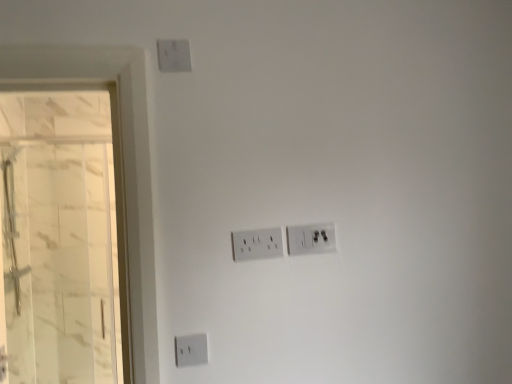
Question: Based on their sizes in the image, would you say white plastic power plugs and sockets at center, the 1th power plugs and sockets viewed from the left, is bigger or smaller than white marble glass door at left?

Choices:
 (A) small
 (B) big

Answer: (A)

Question: Is white plastic power plugs and sockets at center, the 1th power plugs and sockets viewed from the left, in front of or behind white marble glass door at left in the image?

Choices:
 (A) behind
 (B) front

Answer: (B)

Question: Which object is positioned closest to the white marble glass door at left?

Choices:
 (A) white plastic power plugs and sockets at center, the 1th power plugs and sockets viewed from the left
 (B) white plastic power plugs and sockets at center, marked as the 1th power plugs and sockets in a right-to-left arrangement

Answer: (A)

Question: Which object is positioned farthest from the white plastic power plugs and sockets at center, which is the 2th power plugs and sockets in right-to-left order?

Choices:
 (A) white plastic power plugs and sockets at center, placed as the second power plugs and sockets when sorted from left to right
 (B) white marble glass door at left

Answer: (B)